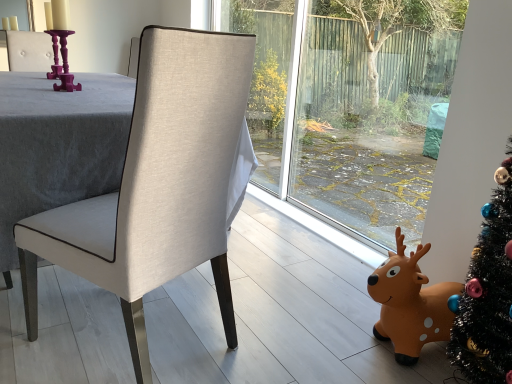
The width and height of the screenshot is (512, 384). I want to click on free space to the back side of orange rubber reindeer at lower right, so pos(350,291).